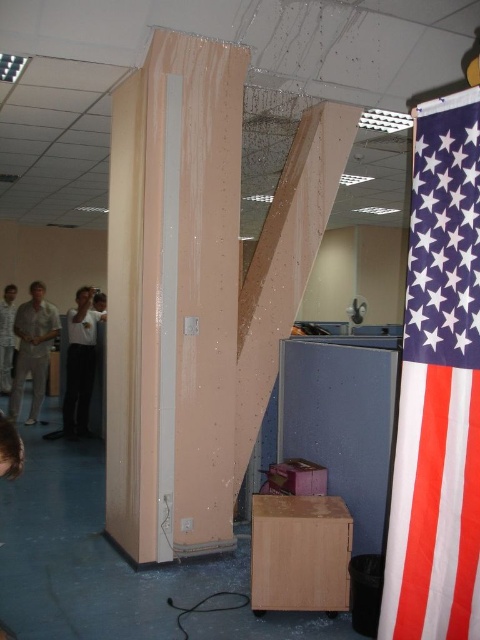
You are standing in the office scene and want to place a small decoration exactly halfway between point (39,408) and point (3,385). Will the decoration be closer to the column or the flag?

The decoration placed halfway between point (39,408) and point (3,385) will be closer to the column because point (39,408) is closer to the camera than point (3,385), meaning the midpoint leans towards the column side.